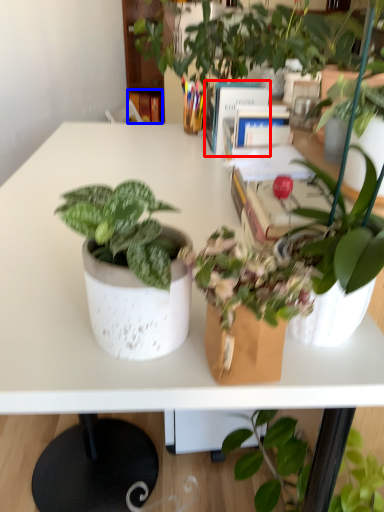
Question: Which object is closer to the camera taking this photo, book (highlighted by a red box) or book (highlighted by a blue box)?

Choices:
 (A) book
 (B) book

Answer: (A)